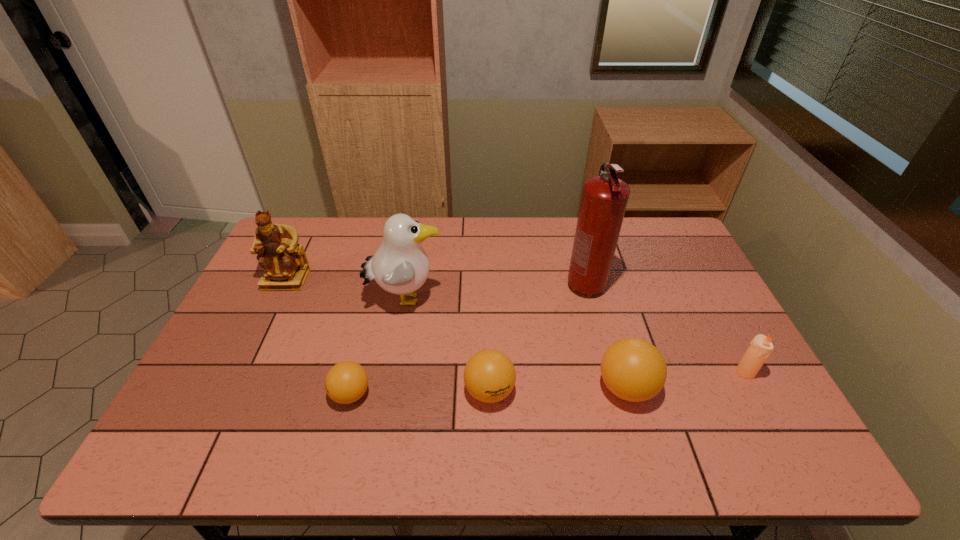
At what (x,y) coordinates should I click in order to perform the action: click on vacant area situated on the side with brand of the leftmost ping-pong ball. Please return your answer as a coordinate pair (x, y). This screenshot has height=540, width=960. Looking at the image, I should click on (237, 394).

Locate an element on the screen. The image size is (960, 540). vacant space situated on the side with brand of the leftmost ping-pong ball is located at coordinates (221, 394).

You are a GUI agent. You are given a task and a screenshot of the screen. Output one action in this format:
    pyautogui.click(x=<x>, y=<y>)
    Task: Click on the vacant space located 0.060m on the side with brand of the leftmost ping-pong ball
    This screenshot has height=540, width=960.
    Given the screenshot: What is the action you would take?
    click(306, 394)

Find the location of a particular element. This screenshot has width=960, height=540. vacant space located on the side with brand of the tallest ping-pong ball is located at coordinates (740, 388).

This screenshot has height=540, width=960. I want to click on vacant space located on the handle side the tallest object, so click(608, 372).

This screenshot has height=540, width=960. Find the location of `free spot located 0.350m on the front-facing side of the third tallest object`. free spot located 0.350m on the front-facing side of the third tallest object is located at coordinates (233, 389).

You are a GUI agent. You are given a task and a screenshot of the screen. Output one action in this format:
    pyautogui.click(x=<x>, y=<y>)
    Task: Click on the vacant area situated on the beak of the sixth shortest object
    
    Given the screenshot: What is the action you would take?
    pyautogui.click(x=537, y=299)

You are a GUI agent. You are given a task and a screenshot of the screen. Output one action in this format:
    pyautogui.click(x=<x>, y=<y>)
    Task: Click on the vacant space located on the front of the rightmost object
    This screenshot has height=540, width=960.
    Given the screenshot: What is the action you would take?
    tap(767, 411)

Identify the location of object that is at the left edge. (284, 261).

Image resolution: width=960 pixels, height=540 pixels. Identify the location of object that is at the right edge. click(760, 348).